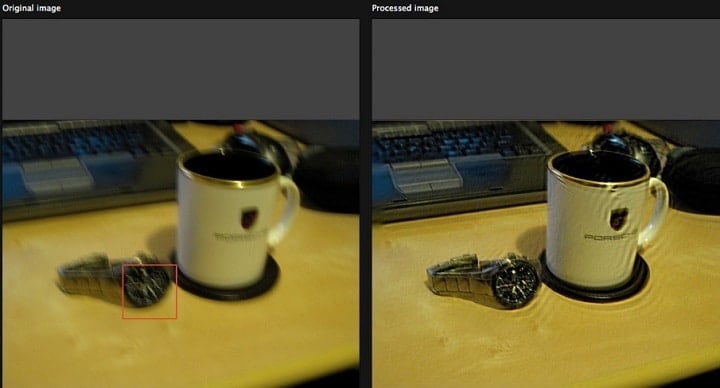
At what (x,y) coordinates should I click in order to perform the action: click on black shield emblem on white mug. Please return your answer as a coordinate pair (x, y). The width and height of the screenshot is (720, 388). Looking at the image, I should click on (618, 220), (243, 217).